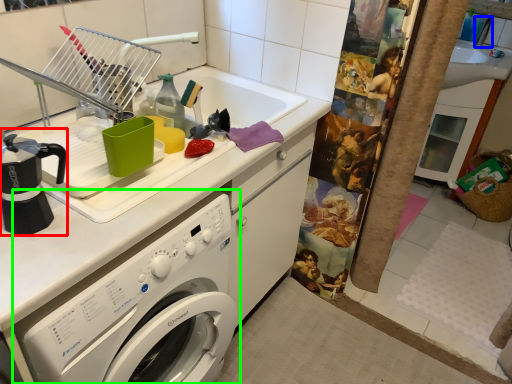
Question: Estimate the real-world distances between objects in this image. Which object is farther from coffeepot (highlighted by a red box), faucet (highlighted by a blue box) or washing machine (highlighted by a green box)?

Choices:
 (A) faucet
 (B) washing machine

Answer: (A)